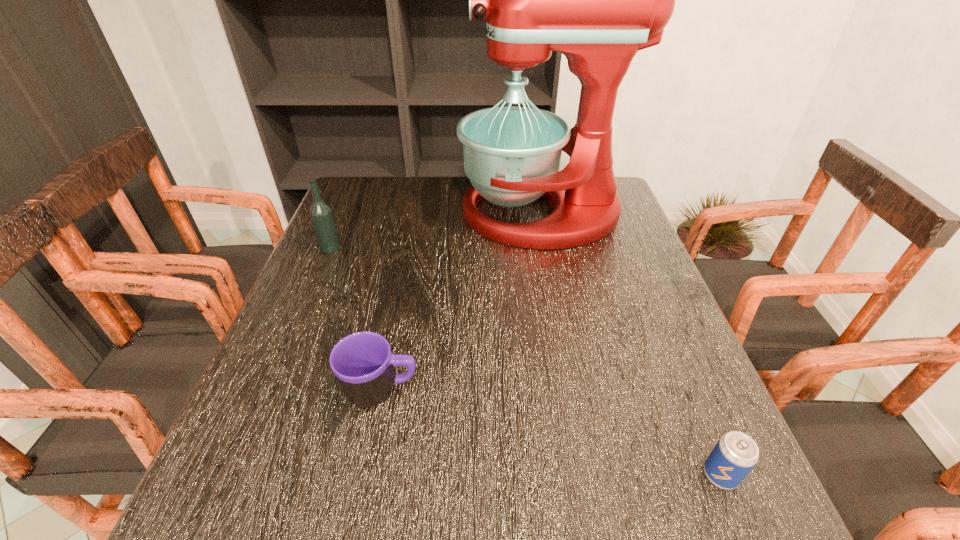
At what (x,y) coordinates should I click in order to perform the action: click on the tallest object. Please return your answer as a coordinate pair (x, y). The height and width of the screenshot is (540, 960). Looking at the image, I should click on (598, 0).

The height and width of the screenshot is (540, 960). What are the coordinates of `the leftmost object` in the screenshot? It's located at (321, 213).

What are the coordinates of `vodka` in the screenshot? It's located at (321, 213).

Identify the location of the third farthest object. This screenshot has width=960, height=540. (363, 363).

You are a GUI agent. You are given a task and a screenshot of the screen. Output one action in this format:
    pyautogui.click(x=<x>, y=<y>)
    Task: Click on the mug
    Image resolution: width=960 pixels, height=540 pixels.
    Given the screenshot: What is the action you would take?
    pyautogui.click(x=363, y=363)

Identify the location of beer can. The image size is (960, 540). (735, 454).

I want to click on the shortest object, so click(735, 454).

This screenshot has width=960, height=540. Find the location of `blank space located on the front-facing side of the mixer`. blank space located on the front-facing side of the mixer is located at coordinates (404, 213).

Locate an element on the screen. vacant region located 0.240m on the front-facing side of the mixer is located at coordinates (376, 213).

The image size is (960, 540). Find the location of `free space located 0.240m on the front-facing side of the mixer`. free space located 0.240m on the front-facing side of the mixer is located at coordinates (376, 213).